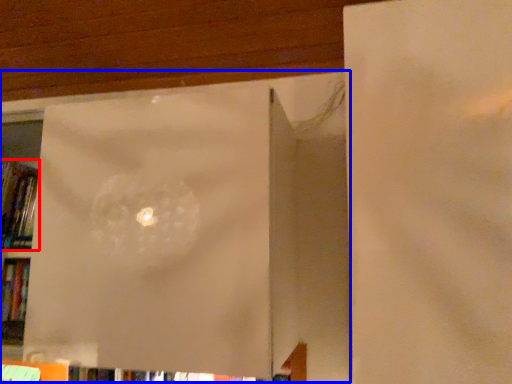
Question: Among these objects, which one is nearest to the camera, book (highlighted by a red box) or window frame (highlighted by a blue box)?

Choices:
 (A) book
 (B) window frame

Answer: (B)